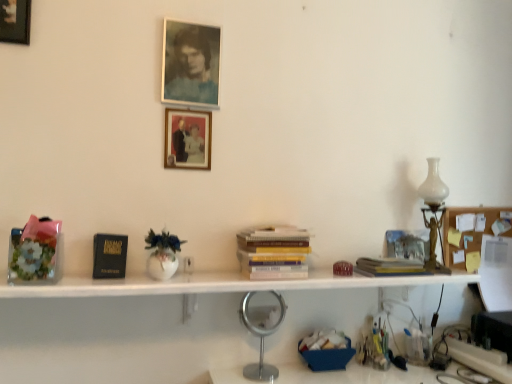
Question: Which direction should I rotate to look at hardcover book at center, the first book from the right?

Choices:
 (A) left
 (B) right

Answer: (B)

Question: Is hardcover books at center, which ranks as the 2th book in right-to-left order, at the back of wooden picture frame at upper left, marked as the 3th picture frame in a bottom-to-top arrangement?

Choices:
 (A) yes
 (B) no

Answer: (B)

Question: Does wooden picture frame at upper left, which appears as the first picture frame when viewed from the top, appear on the right side of hardcover books at center, the first book in the left-to-right sequence?

Choices:
 (A) yes
 (B) no

Answer: (B)

Question: Is wooden picture frame at upper left, arranged as the first picture frame when viewed from the left, thinner than hardcover books at center, which ranks as the 2th book in right-to-left order?

Choices:
 (A) yes
 (B) no

Answer: (A)

Question: Is wooden picture frame at upper left, which appears as the first picture frame when viewed from the top, at the left side of hardcover books at center, which ranks as the 2th book in right-to-left order?

Choices:
 (A) yes
 (B) no

Answer: (A)

Question: From a real-world perspective, is wooden picture frame at upper left, arranged as the first picture frame when viewed from the left, below hardcover books at center, which ranks as the 2th book in right-to-left order?

Choices:
 (A) no
 (B) yes

Answer: (A)

Question: Does wooden picture frame at upper left, marked as the 3th picture frame in a bottom-to-top arrangement, have a greater height compared to hardcover books at center, the first book in the left-to-right sequence?

Choices:
 (A) no
 (B) yes

Answer: (B)

Question: Is silver metallic table lamp at center, the first table lamp viewed from the left, next to black matte paperback book at left?

Choices:
 (A) no
 (B) yes

Answer: (A)

Question: Are silver metallic table lamp at center, the 2th table lamp positioned from the right, and black matte paperback book at left far apart?

Choices:
 (A) no
 (B) yes

Answer: (A)

Question: Does silver metallic table lamp at center, which ranks as the second table lamp in top-to-bottom order, appear on the right side of black matte paperback book at left?

Choices:
 (A) no
 (B) yes

Answer: (B)

Question: Does silver metallic table lamp at center, which appears as the 1th table lamp when ordered from the bottom, have a lesser width compared to black matte paperback book at left?

Choices:
 (A) no
 (B) yes

Answer: (A)

Question: From a real-world perspective, is silver metallic table lamp at center, which ranks as the second table lamp in top-to-bottom order, below black matte paperback book at left?

Choices:
 (A) no
 (B) yes

Answer: (B)

Question: Is silver metallic table lamp at center, the 2th table lamp positioned from the right, bigger than black matte paperback book at left?

Choices:
 (A) no
 (B) yes

Answer: (B)

Question: From a real-world perspective, is matte glass photo frame at upper center, placed as the 2th picture frame when sorted from front to back, located higher than black matte paperback book at left?

Choices:
 (A) yes
 (B) no

Answer: (A)